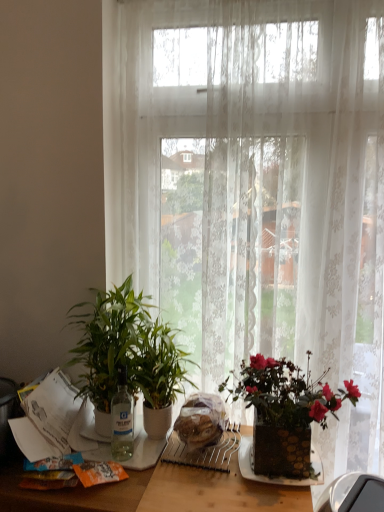
You are a GUI agent. You are given a task and a screenshot of the screen. Output one action in this format:
    pyautogui.click(x=<x>, y=<y>)
    Task: Click on the free location in front of transparent glass bottle at center
    This screenshot has height=512, width=384.
    Given the screenshot: What is the action you would take?
    pyautogui.click(x=116, y=490)